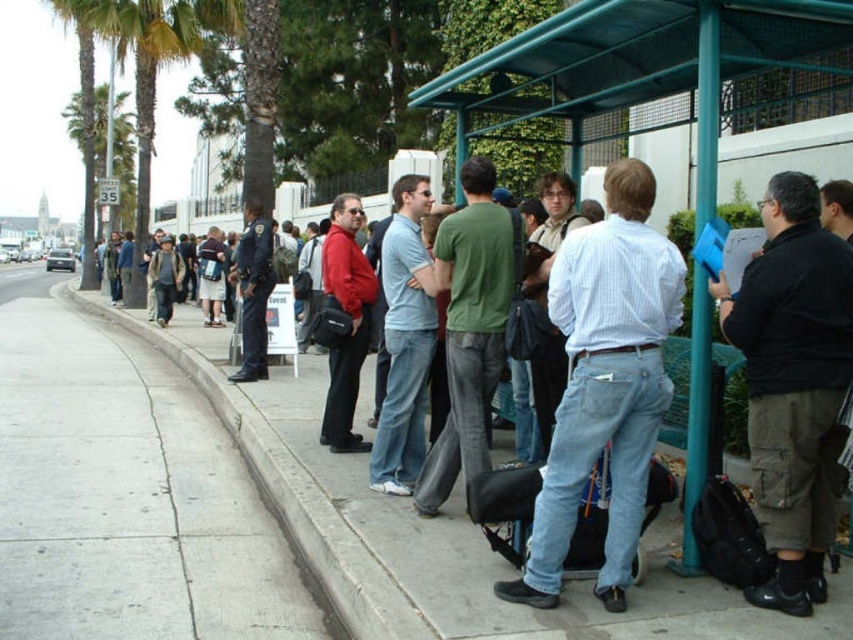
Who is higher up, matte red jacket at center or dark blue uniform at center?

Positioned higher is dark blue uniform at center.

What do you see at coordinates (347, 312) in the screenshot? I see `matte red jacket at center` at bounding box center [347, 312].

At what (x,y) coordinates should I click in order to perform the action: click on matte red jacket at center. Please return your answer as a coordinate pair (x, y). The height and width of the screenshot is (640, 853). Looking at the image, I should click on (347, 312).

Does black cotton shirt at right appear over dark blue uniform at center?

No.

Which of these two, black cotton shirt at right or dark blue uniform at center, stands shorter?

black cotton shirt at right is shorter.

Find the location of `black cotton shirt at right`. black cotton shirt at right is located at coordinates (793, 385).

Is point (128, 548) farther from camera compared to point (790, 260)?

Yes.

Can you confirm if gray concrete sidewalk at lower left is positioned to the right of black cotton shirt at right?

Incorrect, gray concrete sidewalk at lower left is not on the right side of black cotton shirt at right.

Find the location of a particular element. gray concrete sidewalk at lower left is located at coordinates (125, 493).

You are a GUI agent. You are given a task and a screenshot of the screen. Output one action in this format:
    pyautogui.click(x=<x>, y=<y>)
    Task: Click on the gray concrete sidewalk at lower left
    
    Given the screenshot: What is the action you would take?
    pyautogui.click(x=125, y=493)